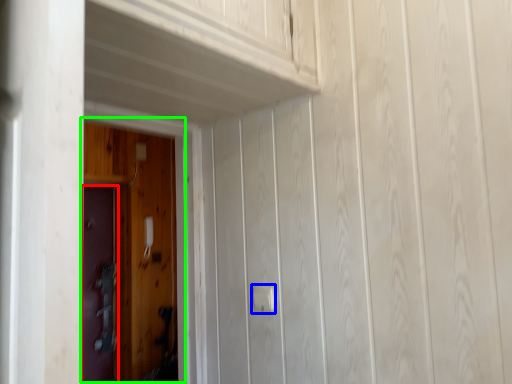
Question: Which object is the farthest from door (highlighted by a red box)? Choose among these: door handle (highlighted by a blue box) or door (highlighted by a green box).

Choices:
 (A) door handle
 (B) door

Answer: (A)